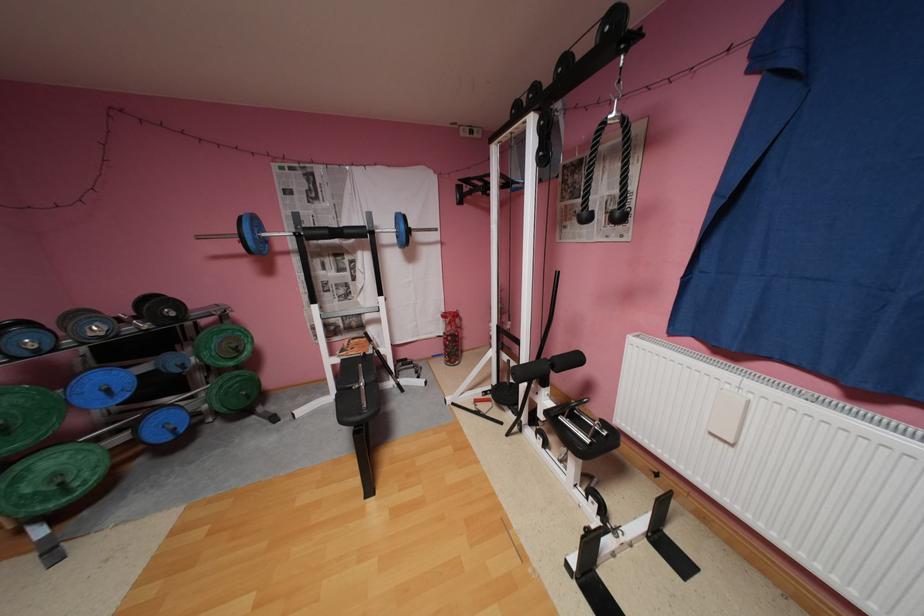
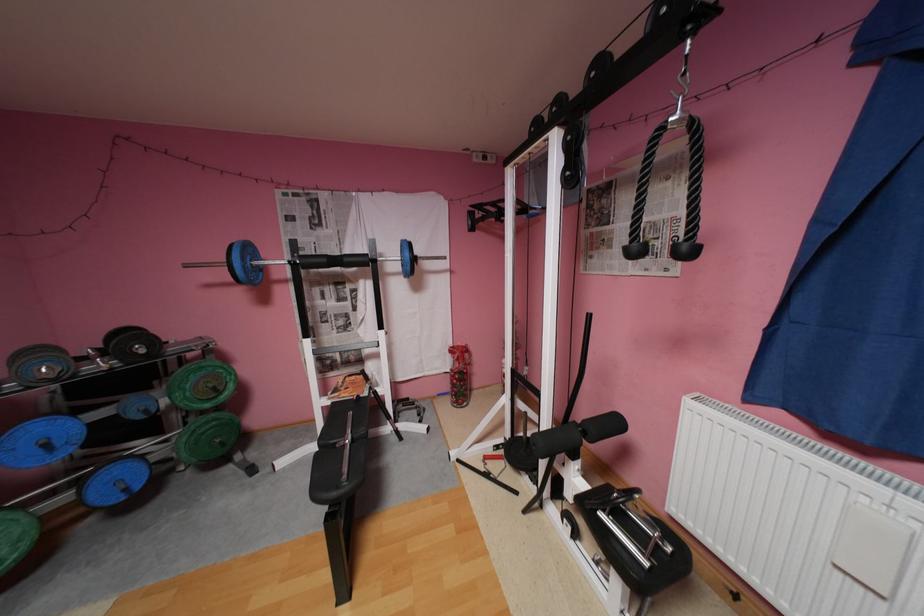
Where in the second image is the point corresponding to the point at 355,231 from the first image?

(355, 259)